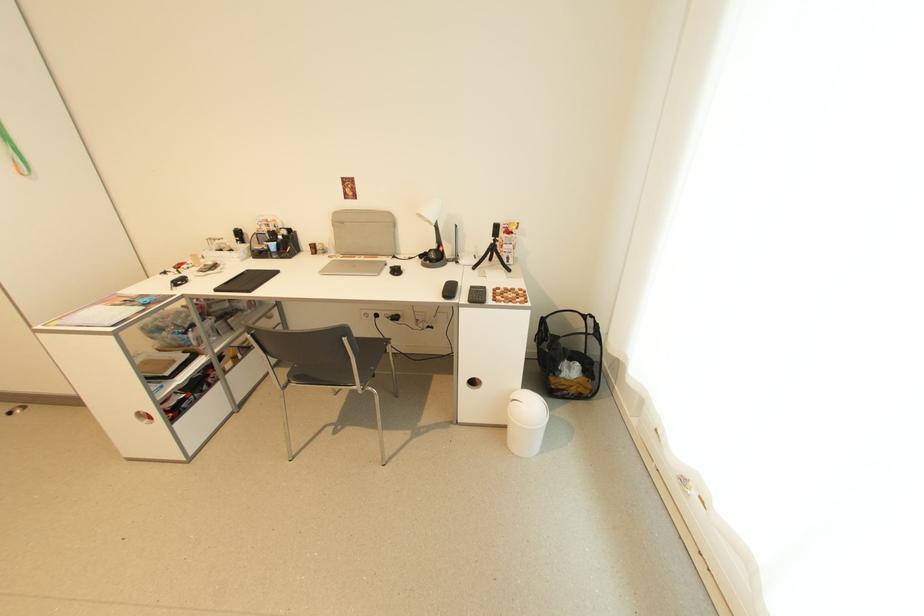
Where would you sit the chair sitting surface? Please return your answer as a coordinate pair (x, y).

(368, 351)